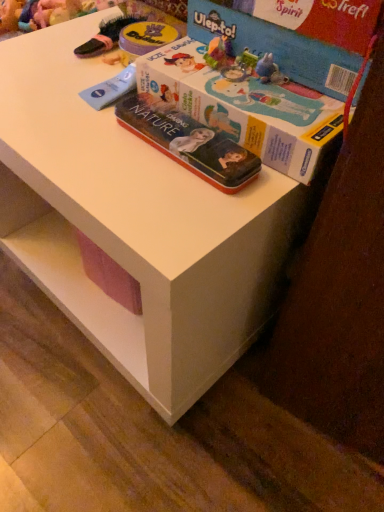
Question: Does metallic tin box at center turn towards blue cardboard box at upper right, which is counted as the 2th box, starting from the top?

Choices:
 (A) no
 (B) yes

Answer: (A)

Question: Does metallic tin box at center appear on the left side of blue cardboard box at upper right, which is counted as the 2th box, starting from the top?

Choices:
 (A) no
 (B) yes

Answer: (B)

Question: Can you confirm if metallic tin box at center is bigger than blue cardboard box at upper right, marked as the first box in a bottom-to-top arrangement?

Choices:
 (A) no
 (B) yes

Answer: (A)

Question: Does metallic tin box at center have a lesser height compared to blue cardboard box at upper right, which is counted as the 2th box, starting from the top?

Choices:
 (A) yes
 (B) no

Answer: (A)

Question: Is there a large distance between metallic tin box at center and blue cardboard box at upper right, marked as the first box in a bottom-to-top arrangement?

Choices:
 (A) yes
 (B) no

Answer: (B)

Question: Can you confirm if metallic tin box at center is thinner than blue cardboard box at upper right, which is counted as the 2th box, starting from the top?

Choices:
 (A) yes
 (B) no

Answer: (A)

Question: Is cardboard box at upper right, placed as the 2th box when sorted from bottom to top, in contact with metallic tin box at center?

Choices:
 (A) yes
 (B) no

Answer: (B)

Question: Is metallic tin box at center completely or partially inside cardboard box at upper right, the first box viewed from the top?

Choices:
 (A) no
 (B) yes

Answer: (A)

Question: Can you confirm if cardboard box at upper right, the first box viewed from the top, is thinner than metallic tin box at center?

Choices:
 (A) no
 (B) yes

Answer: (A)

Question: Is cardboard box at upper right, placed as the 2th box when sorted from bottom to top, oriented away from metallic tin box at center?

Choices:
 (A) yes
 (B) no

Answer: (B)

Question: Is cardboard box at upper right, the first box viewed from the top, to the left of metallic tin box at center from the viewer's perspective?

Choices:
 (A) no
 (B) yes

Answer: (A)

Question: Would you consider cardboard box at upper right, the first box viewed from the top, to be distant from metallic tin box at center?

Choices:
 (A) yes
 (B) no

Answer: (B)

Question: Considering the relative sizes of cardboard box at upper right, placed as the 2th box when sorted from bottom to top, and blue cardboard box at upper right, marked as the first box in a bottom-to-top arrangement, in the image provided, is cardboard box at upper right, placed as the 2th box when sorted from bottom to top, thinner than blue cardboard box at upper right, marked as the first box in a bottom-to-top arrangement,?

Choices:
 (A) no
 (B) yes

Answer: (B)